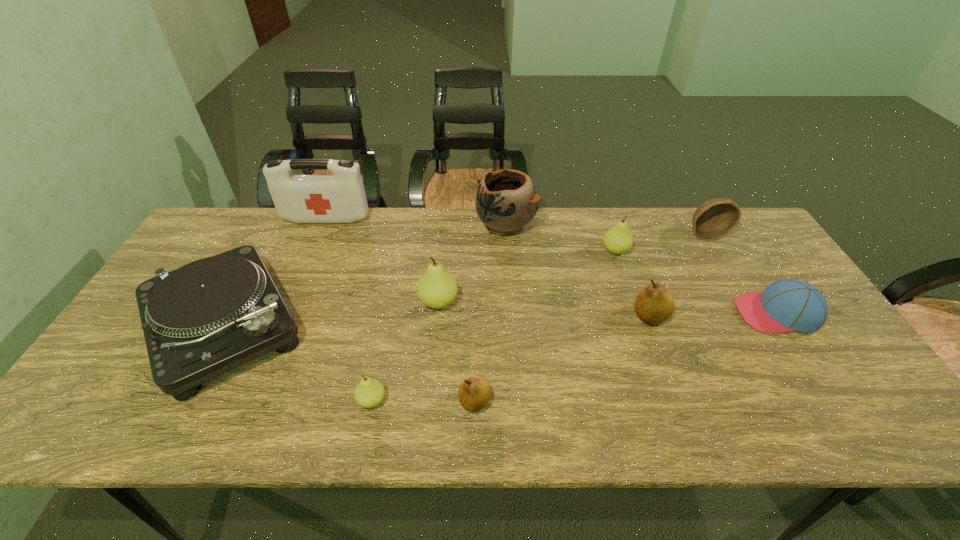
At what (x,y) coordinates should I click in order to perform the action: click on vacant space situated 0.260m on the right of the rightmost green pear. Please return your answer as a coordinate pair (x, y). The image size is (960, 540). Looking at the image, I should click on (713, 251).

What are the coordinates of `free space located on the left of the farther brown pear` in the screenshot? It's located at (594, 316).

Locate an element on the screen. The width and height of the screenshot is (960, 540). free region located on the right of the record player is located at coordinates (371, 326).

This screenshot has width=960, height=540. I want to click on free region located 0.190m on the front-facing side of the baseball cap, so click(x=666, y=313).

Find the location of `vacant space located on the front-facing side of the baseball cap`. vacant space located on the front-facing side of the baseball cap is located at coordinates (666, 313).

Find the location of a particular element. vacant area situated on the front-facing side of the baseball cap is located at coordinates (700, 313).

Locate an element on the screen. free location located 0.190m on the right of the left brown pear is located at coordinates (575, 402).

Locate an element on the screen. The width and height of the screenshot is (960, 540). vacant space situated 0.070m on the right of the eighth object from right to left is located at coordinates (418, 401).

Locate an element on the screen. This screenshot has height=540, width=960. the first-aid kit at the far edge is located at coordinates (339, 198).

The image size is (960, 540). Identify the location of pottery that is at the far edge. pos(506,201).